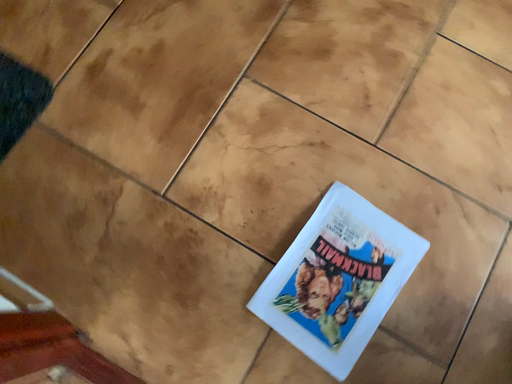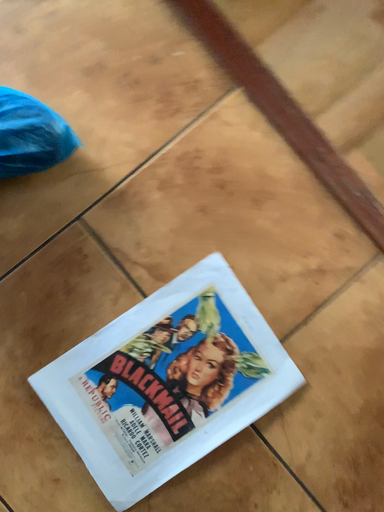
Question: How did the camera likely rotate when shooting the video?

Choices:
 (A) rotated left
 (B) rotated right

Answer: (B)